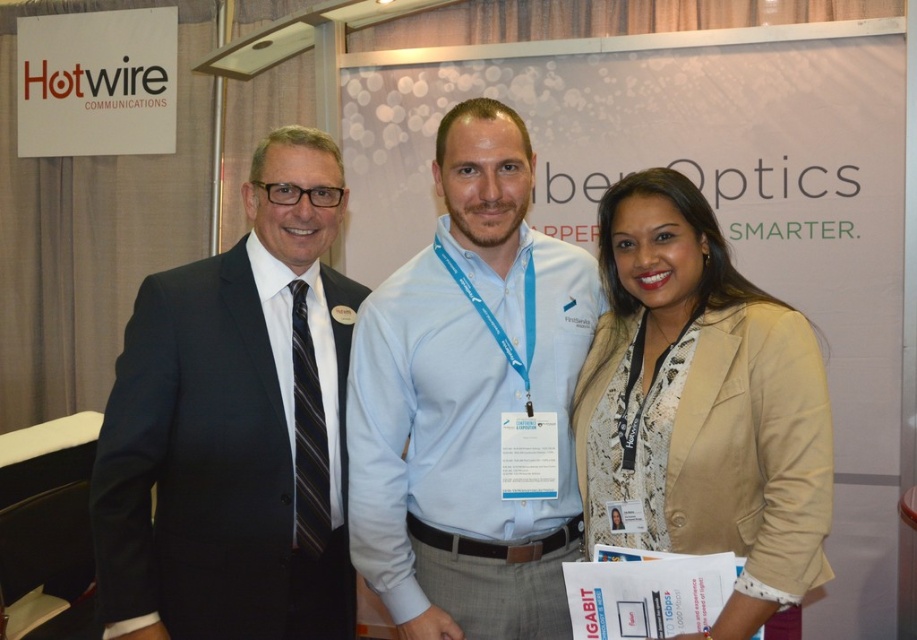
Question: Can you confirm if white paperboard at center is positioned below black suit at left?

Choices:
 (A) no
 (B) yes

Answer: (A)

Question: Does black suit at left have a smaller size compared to beige textured blazer at center?

Choices:
 (A) yes
 (B) no

Answer: (B)

Question: Which point appears closest to the camera in this image?

Choices:
 (A) (447, 467)
 (B) (853, 154)
 (C) (117, 433)

Answer: (C)

Question: Considering the real-world distances, which object is closest to the light blue jersey at center?

Choices:
 (A) black suit at left
 (B) white paperboard at center
 (C) beige textured blazer at center

Answer: (C)

Question: Among these points, which one is farthest from the camera?

Choices:
 (A) (755, 141)
 (B) (700, 266)

Answer: (A)

Question: Is white paperboard at center smaller than black suit at left?

Choices:
 (A) yes
 (B) no

Answer: (B)